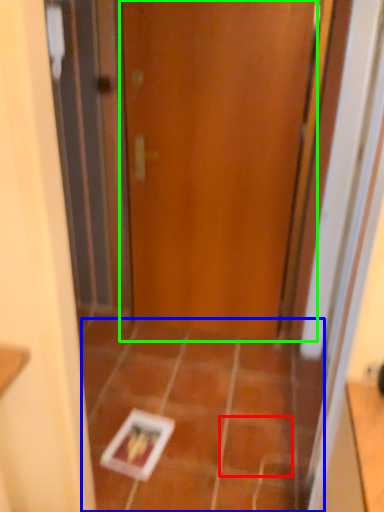
Question: Which object is the closest to the ceramic tile (highlighted by a red box)? Choose among these: ceramic tile (highlighted by a blue box) or door (highlighted by a green box).

Choices:
 (A) ceramic tile
 (B) door

Answer: (A)